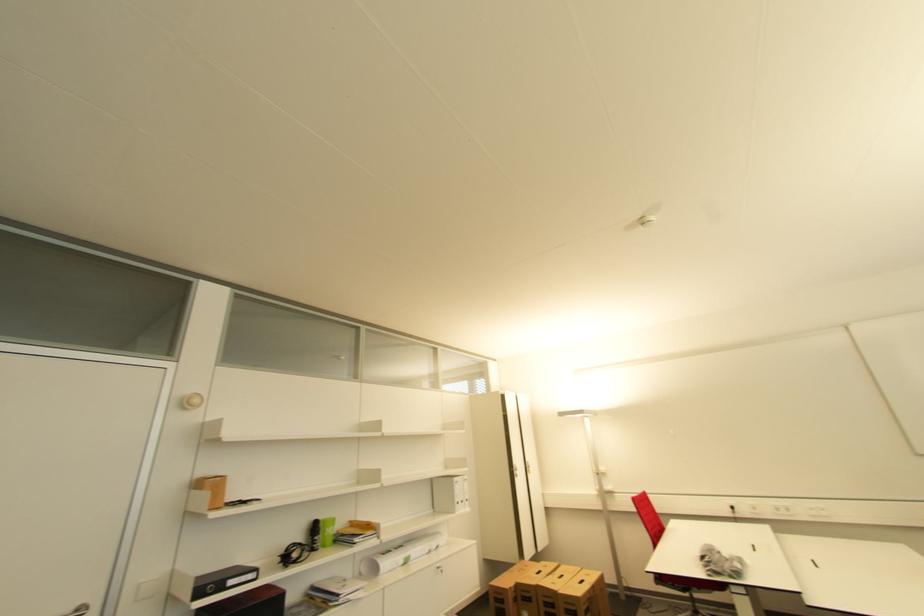
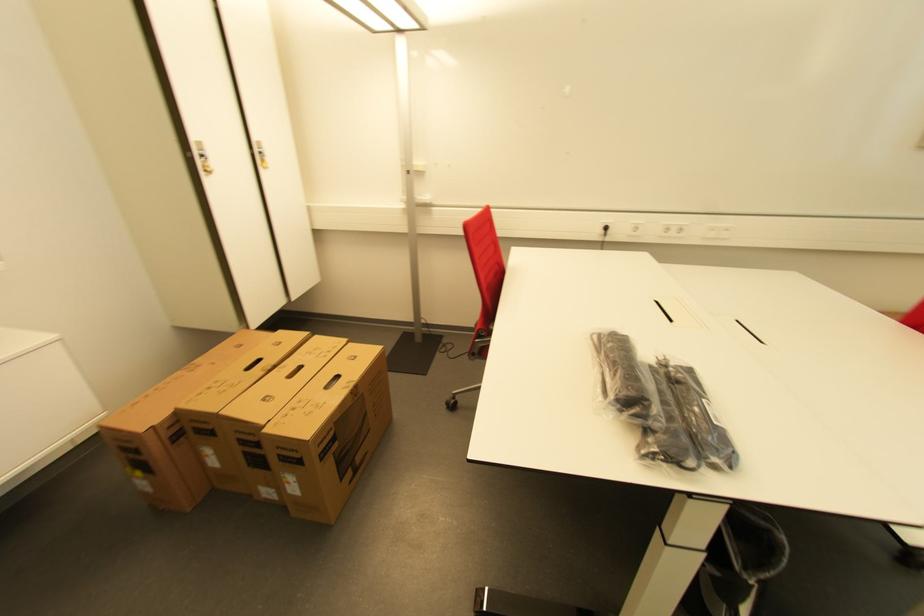
In the second image, find the point that corresponds to [737,509] in the first image.

(611, 230)